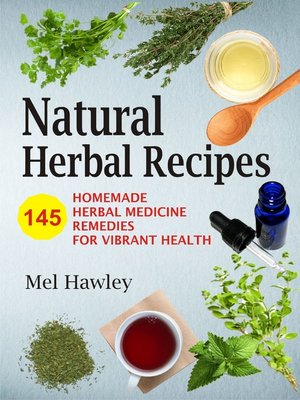
Where is `handle`? The image size is (300, 400). handle is located at coordinates (139, 377).